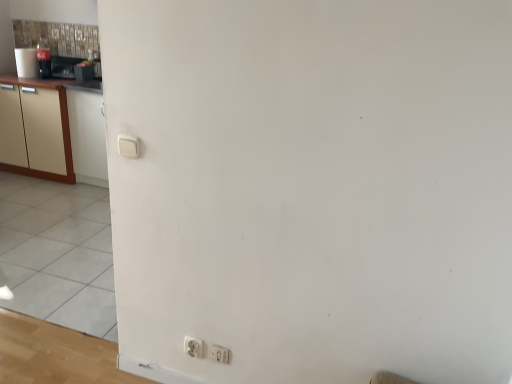
Question: From a real-world perspective, is metallic silver toaster at upper left positioned over white plastic electric outlet at lower center, which is counted as the second electric outlet, starting from the right, based on gravity?

Choices:
 (A) yes
 (B) no

Answer: (A)

Question: Considering the relative positions of metallic silver toaster at upper left and white plastic electric outlet at lower center, which appears as the first electric outlet when viewed from the left, in the image provided, is metallic silver toaster at upper left in front of white plastic electric outlet at lower center, which appears as the first electric outlet when viewed from the left,?

Choices:
 (A) no
 (B) yes

Answer: (A)

Question: Can you confirm if metallic silver toaster at upper left is shorter than white plastic electric outlet at lower center, which appears as the first electric outlet when viewed from the left?

Choices:
 (A) no
 (B) yes

Answer: (A)

Question: Is metallic silver toaster at upper left not within white plastic electric outlet at lower center, which appears as the first electric outlet when viewed from the left?

Choices:
 (A) no
 (B) yes

Answer: (B)

Question: Considering the relative positions of metallic silver toaster at upper left and white plastic electric outlet at lower center, which is counted as the second electric outlet, starting from the right, in the image provided, is metallic silver toaster at upper left to the right of white plastic electric outlet at lower center, which is counted as the second electric outlet, starting from the right, from the viewer's perspective?

Choices:
 (A) no
 (B) yes

Answer: (A)

Question: Is metallic silver toaster at upper left facing towards white plastic electric outlet at lower center, which is counted as the second electric outlet, starting from the right?

Choices:
 (A) no
 (B) yes

Answer: (A)

Question: Is the position of beige wood cabinetry at left less distant than that of white plastic electric outlet at lower center, which is the 1th electric outlet in right-to-left order?

Choices:
 (A) yes
 (B) no

Answer: (B)

Question: Would you say white plastic electric outlet at lower center, which is the 1th electric outlet in right-to-left order, is part of beige wood cabinetry at left's contents?

Choices:
 (A) no
 (B) yes

Answer: (A)

Question: Considering the relative sizes of beige wood cabinetry at left and white plastic electric outlet at lower center, which is the 1th electric outlet in right-to-left order, in the image provided, is beige wood cabinetry at left bigger than white plastic electric outlet at lower center, which is the 1th electric outlet in right-to-left order,?

Choices:
 (A) yes
 (B) no

Answer: (A)

Question: Can we say beige wood cabinetry at left lies outside white plastic electric outlet at lower center, which is the 1th electric outlet in right-to-left order?

Choices:
 (A) no
 (B) yes

Answer: (B)

Question: Can you confirm if beige wood cabinetry at left is wider than white plastic electric outlet at lower center, which is the 1th electric outlet in right-to-left order?

Choices:
 (A) yes
 (B) no

Answer: (A)

Question: From the image's perspective, is beige wood cabinetry at left over white plastic electric outlet at lower center, the second electric outlet when ordered from left to right?

Choices:
 (A) yes
 (B) no

Answer: (A)

Question: Is white plastic electric outlet at lower center, which appears as the first electric outlet when viewed from the left, looking in the opposite direction of beige wood cabinetry at left?

Choices:
 (A) yes
 (B) no

Answer: (B)